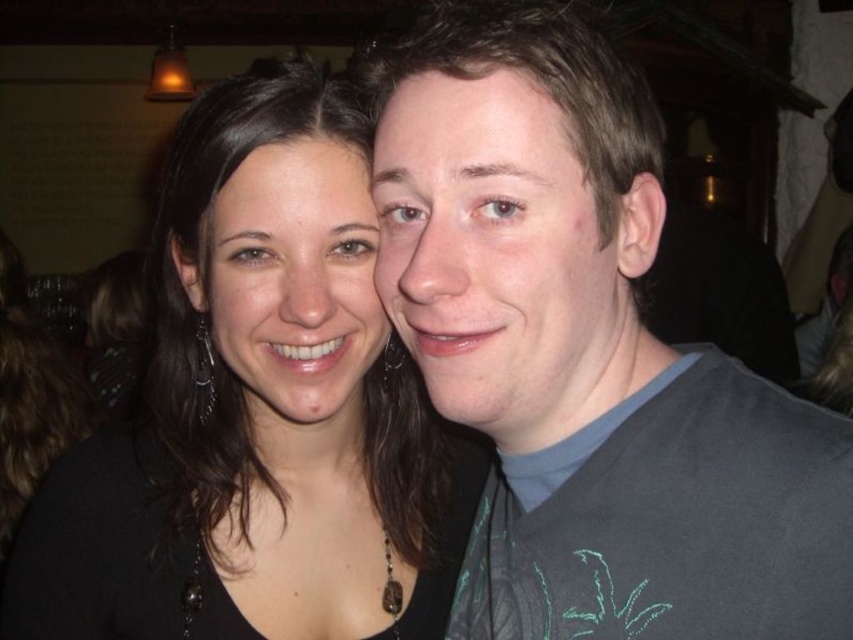
Between gray fabric shirt at center and black matte hair at center, which one is positioned higher?

gray fabric shirt at center

Is gray fabric shirt at center to the right of black matte hair at center from the viewer's perspective?

Correct, you'll find gray fabric shirt at center to the right of black matte hair at center.

Who is more forward, (752, 509) or (106, 588)?

Positioned in front is point (752, 509).

Identify the location of gray fabric shirt at center. tap(587, 355).